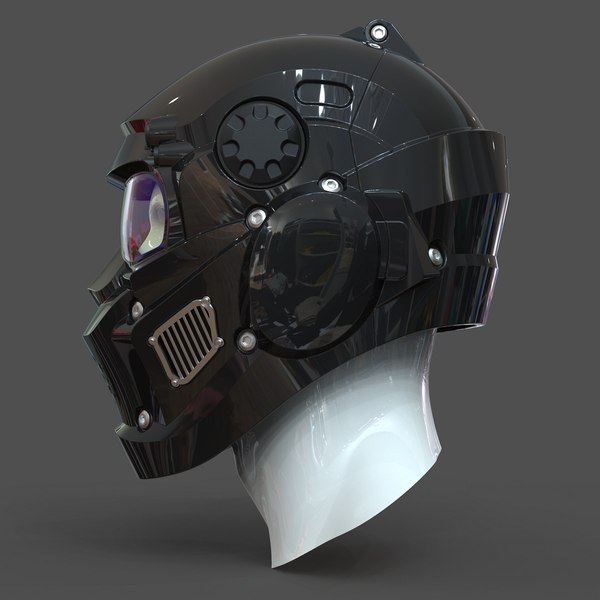
Locate an element on the screen. The height and width of the screenshot is (600, 600). mannequin is located at coordinates (343, 467).